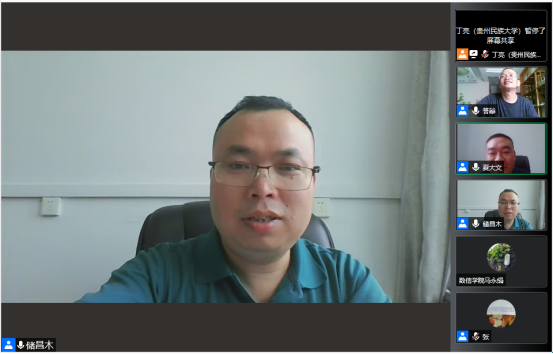
This screenshot has width=553, height=354. I want to click on power outlet, so [46, 209].